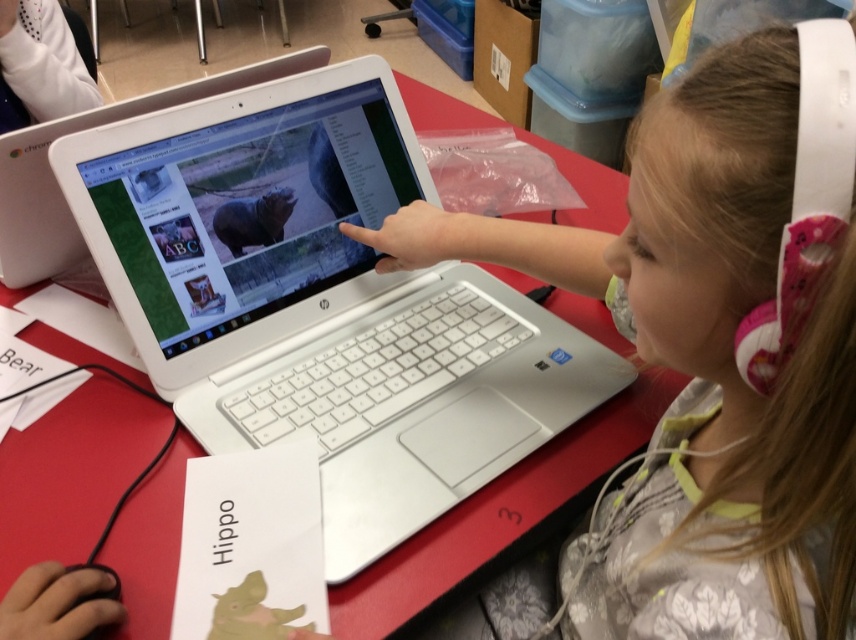
Between white plastic headphones at upper right and white plastic laptop at upper center, which one is positioned higher?

Positioned higher is white plastic laptop at upper center.

Is white plastic headphones at upper right shorter than white plastic laptop at upper center?

No.

Between point (730, 522) and point (182, 99), which one is positioned behind?

Positioned behind is point (182, 99).

Where is `white plastic headphones at upper right`? white plastic headphones at upper right is located at coordinates (716, 344).

Can you confirm if white plastic laptop at center is shorter than white plastic headphones at upper right?

No.

Which is in front, point (562, 353) or point (789, 520)?

Point (789, 520) is more forward.

Describe the element at coordinates (321, 300) in the screenshot. I see `white plastic laptop at center` at that location.

The width and height of the screenshot is (856, 640). What are the coordinates of `white plastic laptop at center` in the screenshot? It's located at (321, 300).

Between white plastic laptop at center and white plastic laptop at upper center, which one is positioned higher?

white plastic laptop at upper center

Is point (456, 448) positioned behind point (31, 243)?

No, (456, 448) is in front of (31, 243).

You are a GUI agent. You are given a task and a screenshot of the screen. Output one action in this format:
    pyautogui.click(x=<x>, y=<y>)
    Task: Click on the white plastic laptop at center
    
    Given the screenshot: What is the action you would take?
    pyautogui.click(x=321, y=300)